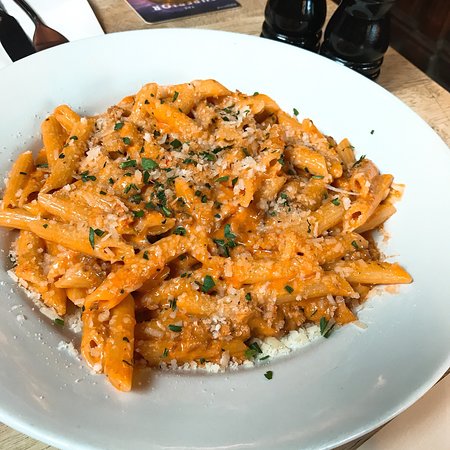
The width and height of the screenshot is (450, 450). What are the coordinates of `napkin` in the screenshot? It's located at (73, 15).